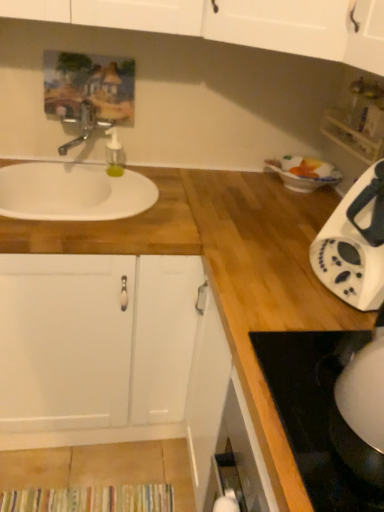
Question: From the image's perspective, is white plastic toaster at right under white glossy kettle at lower right?

Choices:
 (A) yes
 (B) no

Answer: (B)

Question: Is white glossy kettle at lower right located within white plastic toaster at right?

Choices:
 (A) yes
 (B) no

Answer: (B)

Question: Is white plastic toaster at right shorter than white glossy kettle at lower right?

Choices:
 (A) yes
 (B) no

Answer: (B)

Question: From a real-world perspective, is white plastic toaster at right on top of white glossy kettle at lower right?

Choices:
 (A) yes
 (B) no

Answer: (A)

Question: Is white plastic toaster at right turned away from white glossy kettle at lower right?

Choices:
 (A) no
 (B) yes

Answer: (A)

Question: Is point (28, 346) closer or farther from the camera than point (342, 115)?

Choices:
 (A) closer
 (B) farther

Answer: (A)

Question: Visually, is white matte cabinet at left positioned to the left or to the right of white plastic shelf at upper right?

Choices:
 (A) left
 (B) right

Answer: (A)

Question: From the image's perspective, is white matte cabinet at left above or below white plastic shelf at upper right?

Choices:
 (A) below
 (B) above

Answer: (A)

Question: Is white matte cabinet at left wider or thinner than white plastic shelf at upper right?

Choices:
 (A) wide
 (B) thin

Answer: (A)

Question: In terms of size, does white matte cabinet at left appear bigger or smaller than white glossy electric kettle at lower right?

Choices:
 (A) big
 (B) small

Answer: (A)

Question: Relative to white glossy electric kettle at lower right, is white matte cabinet at left in front or behind?

Choices:
 (A) behind
 (B) front

Answer: (A)

Question: From the image's perspective, is white matte cabinet at left positioned above or below white glossy electric kettle at lower right?

Choices:
 (A) above
 (B) below

Answer: (B)

Question: From a real-world perspective, relative to white glossy electric kettle at lower right, is white matte cabinet at left vertically above or below?

Choices:
 (A) below
 (B) above

Answer: (A)

Question: Considering the relative positions of white matte cabinet at left and metallic faucet at upper left in the image provided, is white matte cabinet at left to the left or to the right of metallic faucet at upper left?

Choices:
 (A) right
 (B) left

Answer: (B)

Question: Is white matte cabinet at left inside or outside of metallic faucet at upper left?

Choices:
 (A) outside
 (B) inside

Answer: (A)